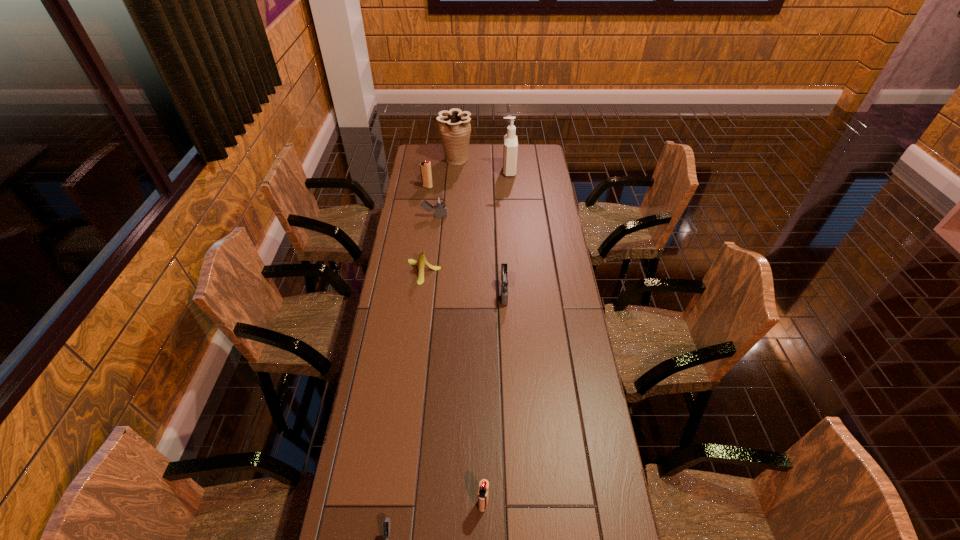
Identify which gray igniter is located as the nearest to the farthest gray igniter. Please provide its 2D coordinates. Your answer should be formatted as a tuple, i.e. [(x, y)], where the tuple contains the x and y coordinates of a point satisfying the conditions above.

[(505, 279)]

Where is `gray igniter that is the closest one to the fourth farthest object`? gray igniter that is the closest one to the fourth farthest object is located at coordinates (505, 279).